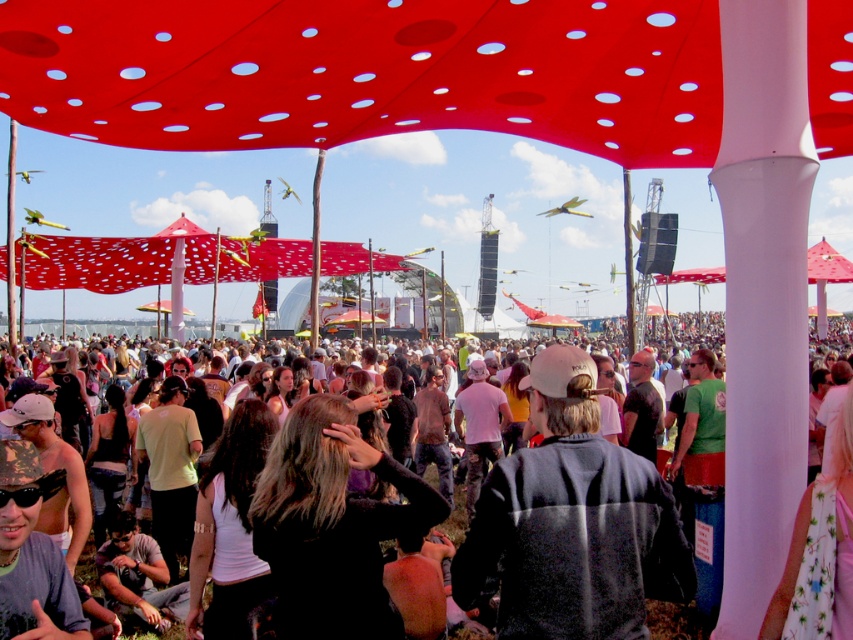
Is point (634, 560) closer to viewer compared to point (392, 476)?

Yes, point (634, 560) is in front of point (392, 476).

Is dark gray jacket at center positioned behind black matte hair at center?

No, it is in front of black matte hair at center.

Which is behind, point (494, 515) or point (345, 634)?

Positioned behind is point (345, 634).

The width and height of the screenshot is (853, 640). In order to click on dark gray jacket at center in this screenshot , I will do `click(572, 522)`.

Can you confirm if dark gray jacket at center is thinner than black casual clothing at center?

Yes, dark gray jacket at center is thinner than black casual clothing at center.

Between dark gray jacket at center and black casual clothing at center, which one appears on the right side from the viewer's perspective?

dark gray jacket at center

Is point (631, 524) less distant than point (62, 317)?

Yes, point (631, 524) is closer to viewer.

Find the location of a particular element. This screenshot has height=640, width=853. dark gray jacket at center is located at coordinates (572, 522).

Does red perforated canopy at upper center have a smaller size compared to dark gray jacket at center?

Actually, red perforated canopy at upper center might be larger than dark gray jacket at center.

Can you confirm if red perforated canopy at upper center is thinner than dark gray jacket at center?

In fact, red perforated canopy at upper center might be wider than dark gray jacket at center.

The height and width of the screenshot is (640, 853). What do you see at coordinates (369, 72) in the screenshot?
I see `red perforated canopy at upper center` at bounding box center [369, 72].

Locate an element on the screen. The image size is (853, 640). red perforated canopy at upper center is located at coordinates (369, 72).